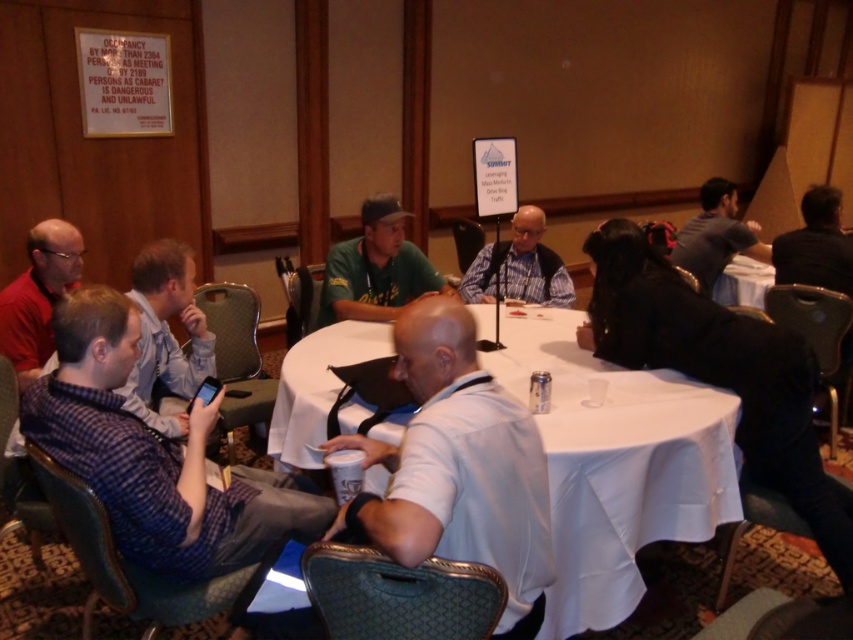
Question: Which object is positioned farthest from the blue fabric shirt at center?

Choices:
 (A) blue plaid shirt at left
 (B) plaid shirt at center
 (C) white matte shirt at center

Answer: (B)

Question: Can you confirm if white matte shirt at center is positioned above black leather jacket at upper right?

Choices:
 (A) no
 (B) yes

Answer: (A)

Question: Which is farther from the plaid shirt at center?

Choices:
 (A) white cloth table at center
 (B) white matte shirt at center
 (C) black leather jacket at upper right

Answer: (B)

Question: Is blue plaid shirt at left below dark gray shirt at right?

Choices:
 (A) yes
 (B) no

Answer: (A)

Question: Can you confirm if blue plaid shirt at left is wider than black leather jacket at upper right?

Choices:
 (A) yes
 (B) no

Answer: (A)

Question: Which of the following is the closest to the observer?

Choices:
 (A) (387, 204)
 (B) (20, 275)
 (C) (824, 268)
 (D) (544, 316)

Answer: (A)